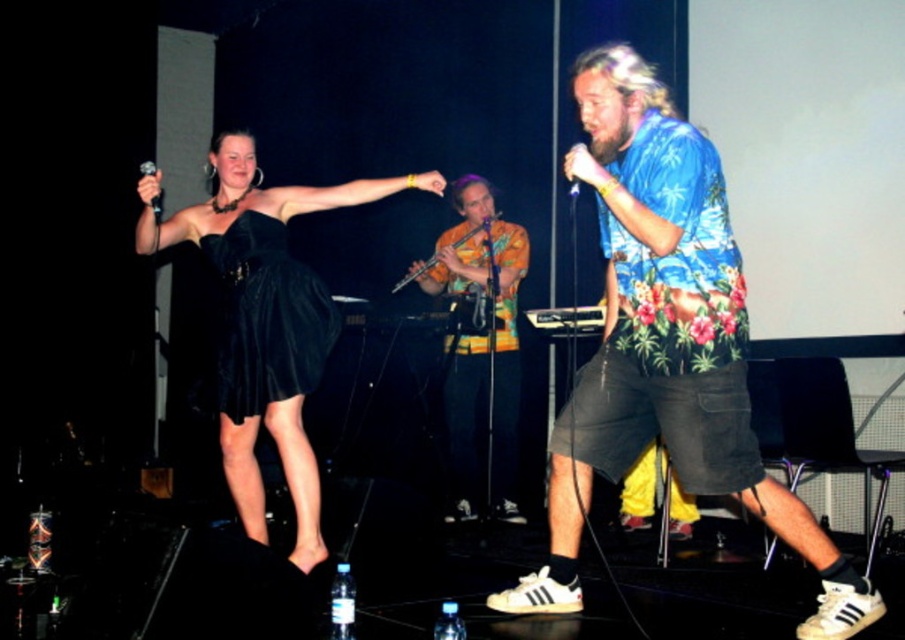
You are designing a stage layout and need to place a narrow spotlight on the thinner item between the floral print shirt at center and the black satin dress at upper left. Which item should the spotlight be directed towards?

The floral print shirt at center is thinner than the black satin dress at upper left, so the spotlight should be directed towards the floral print shirt at center.

You are a photographer at the back of the stage. You want to capture a photo of both the floral print shirt at center and the black velvet dress at center in the same frame. Which object should you focus on first to ensure both are in the frame?

The floral print shirt at center is larger in size than the black velvet dress at center, so you should focus on the floral print shirt at center first to ensure both are in the frame since it takes up more space and will help frame the shot better.

In the performance scene, you notice two performers on stage. One is wearing a floral print shirt at center and the other a black satin dress at upper left. From the audience perspective, which performer is positioned to the right side?

The floral print shirt at center is positioned to the right of the black satin dress at upper left, so from the audience perspective, the floral print shirt at center is on the right side.